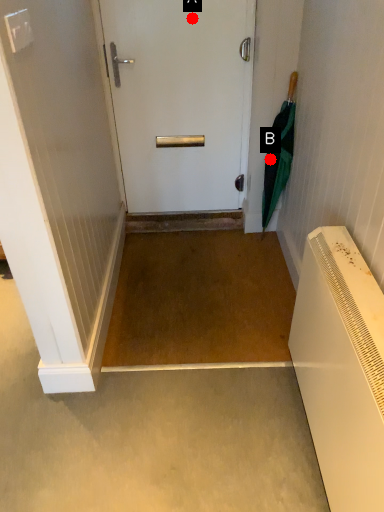
Question: Two points are circled on the image, labeled by A and B beside each circle. Which point appears farthest from the camera in this image?

Choices:
 (A) A is further
 (B) B is further

Answer: (B)